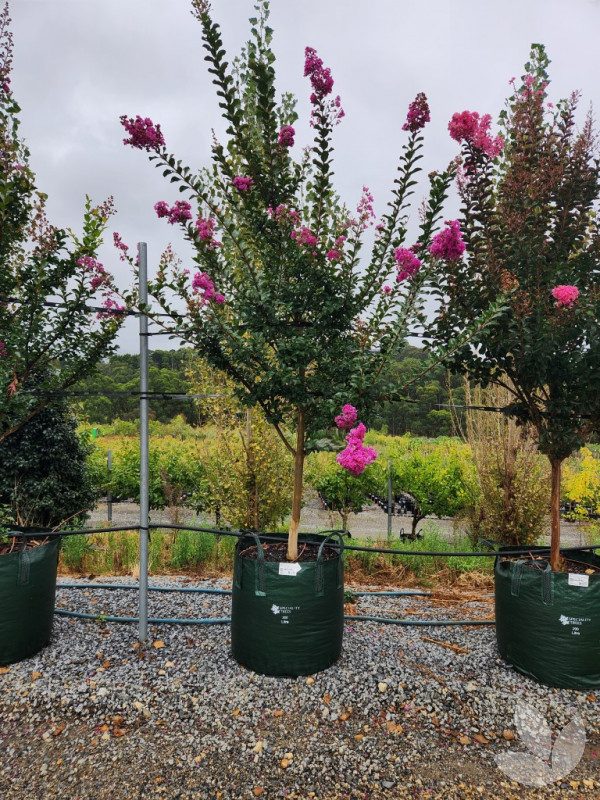
The image size is (600, 800). I want to click on flower pots, so click(21, 586), click(289, 606), click(540, 617).